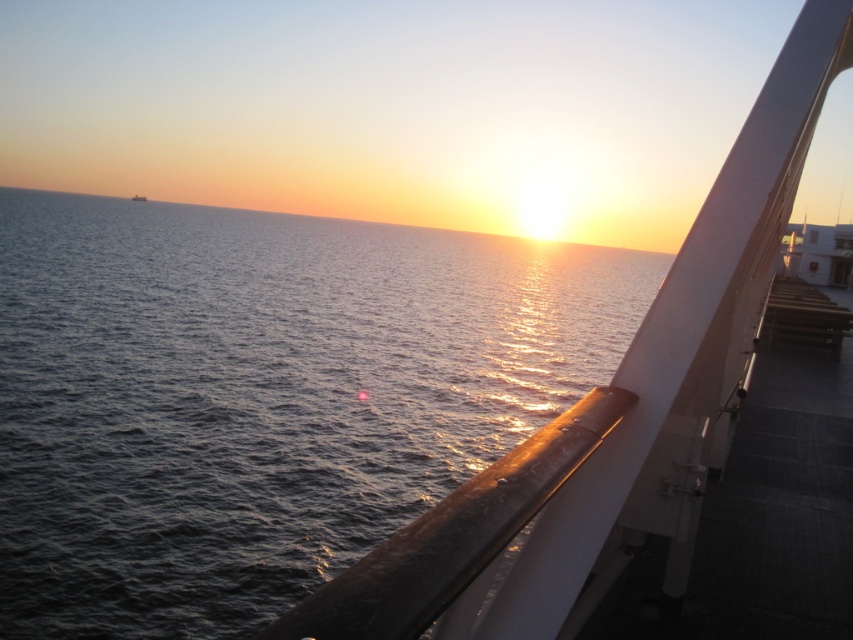
Question: Among these objects, which one is nearest to the camera?

Choices:
 (A) smooth white railing at upper right
 (B) dark blue water at center

Answer: (A)

Question: Considering the relative positions of dark blue water at center and smooth white railing at upper right in the image provided, where is dark blue water at center located with respect to smooth white railing at upper right?

Choices:
 (A) left
 (B) right

Answer: (A)

Question: Is the position of dark blue water at center less distant than that of smooth white railing at upper right?

Choices:
 (A) no
 (B) yes

Answer: (A)

Question: Is dark blue water at center to the left of smooth white railing at upper right from the viewer's perspective?

Choices:
 (A) no
 (B) yes

Answer: (B)

Question: Which of the following is the farthest from the observer?

Choices:
 (A) smooth white railing at upper right
 (B) dark blue water at center

Answer: (B)